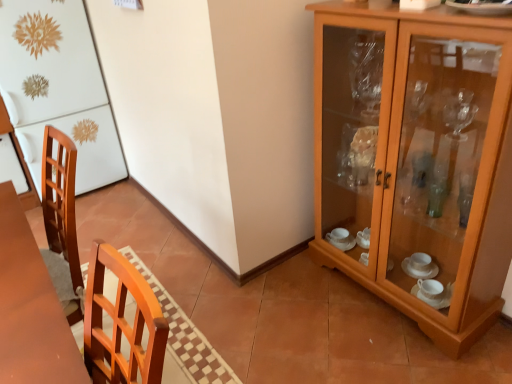
I want to click on free space to the left of wooden cabinet at right, so click(x=301, y=309).